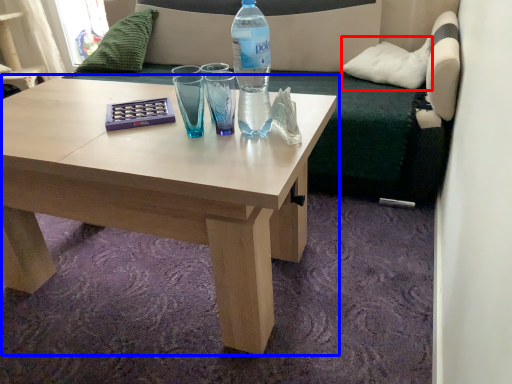
Question: Which object is closer to the camera taking this photo, pillow (highlighted by a red box) or coffee table (highlighted by a blue box)?

Choices:
 (A) pillow
 (B) coffee table

Answer: (B)